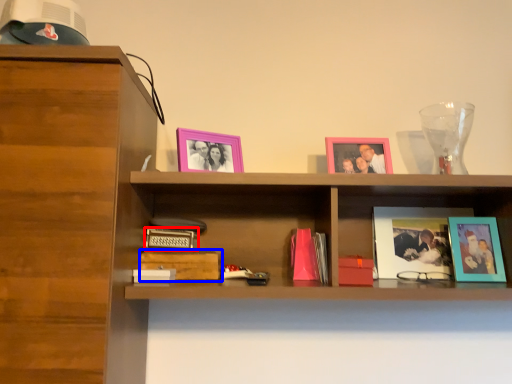
Question: Among these objects, which one is farthest to the camera, paperback book (highlighted by a red box) or paperback book (highlighted by a blue box)?

Choices:
 (A) paperback book
 (B) paperback book

Answer: (A)